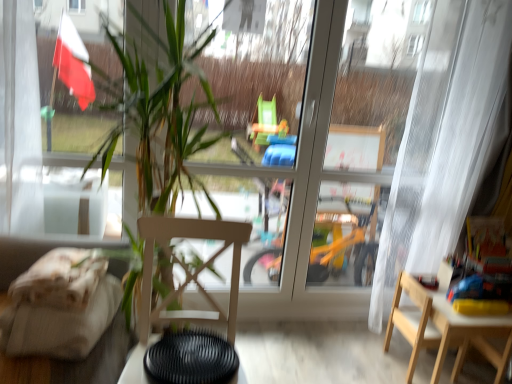
I want to click on vacant space that is to the left of light wood chair at lower right, the 1th chair positioned from the back, so click(367, 354).